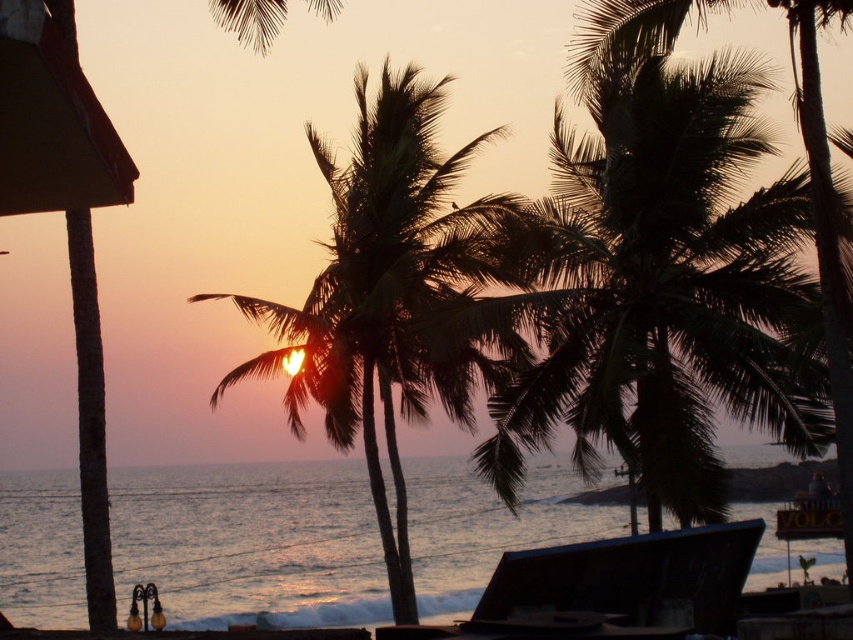
Question: Is dark green leafy palm tree at center thinner than silhouette leafy palm at center?

Choices:
 (A) yes
 (B) no

Answer: (A)

Question: Does dark green leafy palm tree at center have a smaller size compared to silvery water at center?

Choices:
 (A) yes
 (B) no

Answer: (A)

Question: Which object is positioned farthest from the silhouette leafy palm at center?

Choices:
 (A) dark green leafy palm tree at center
 (B) silvery water at center

Answer: (B)

Question: Which object appears closest to the camera in this image?

Choices:
 (A) silhouette leafy palm at center
 (B) dark green leafy palm tree at center
 (C) silvery water at center

Answer: (C)

Question: Is dark green leafy palm tree at center to the right of silhouette leafy palm at center from the viewer's perspective?

Choices:
 (A) no
 (B) yes

Answer: (B)

Question: Among these objects, which one is nearest to the camera?

Choices:
 (A) silhouette leafy palm at center
 (B) dark green leafy palm tree at center

Answer: (A)